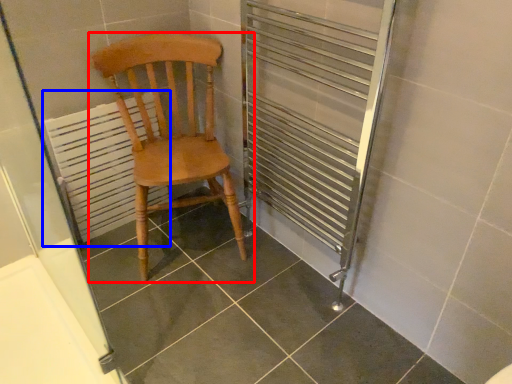
Question: Which point is closer to the camera, chair (highlighted by a red box) or radiator (highlighted by a blue box)?

Choices:
 (A) chair
 (B) radiator

Answer: (A)